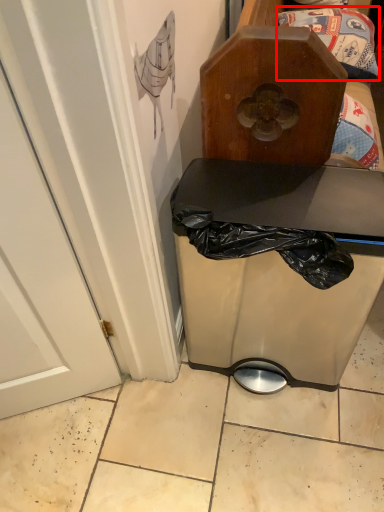
Question: From the image, what is the correct spatial relationship of waste (annotated by the red box) in relation to furniture?

Choices:
 (A) right
 (B) left

Answer: (B)